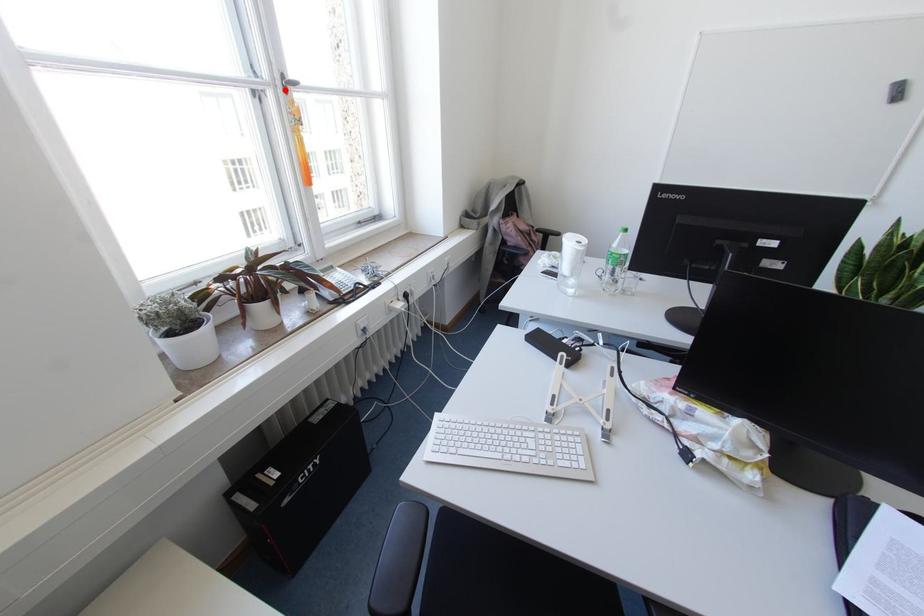
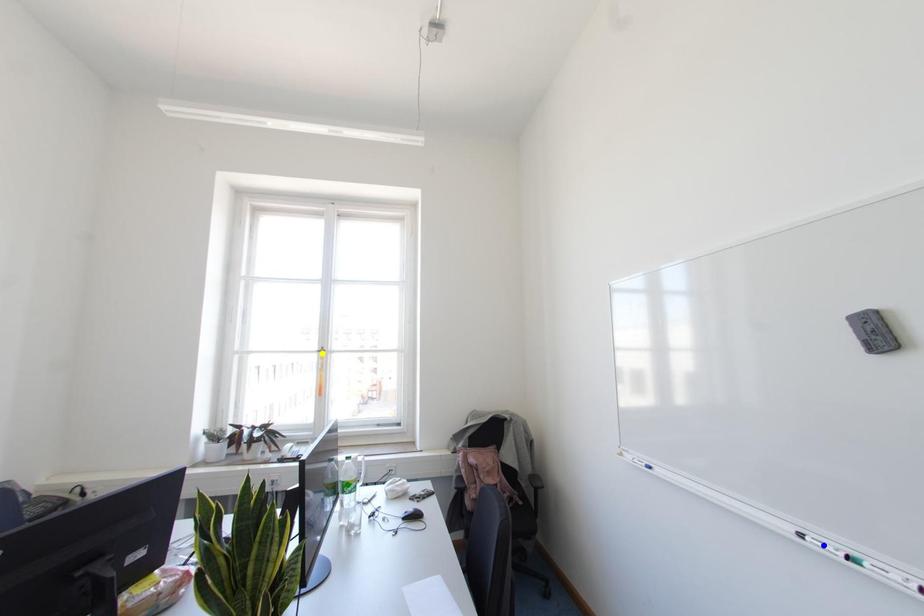
Question: I am providing you with two images of the same scene from different viewpoints. A red point is marked on the first image. You are given multiple points on the second image. Which point in image 2 represents the same 3d spot as the red point in image 1?

Choices:
 (A) blue point
 (B) yellow point
 (C) green point

Answer: (B)